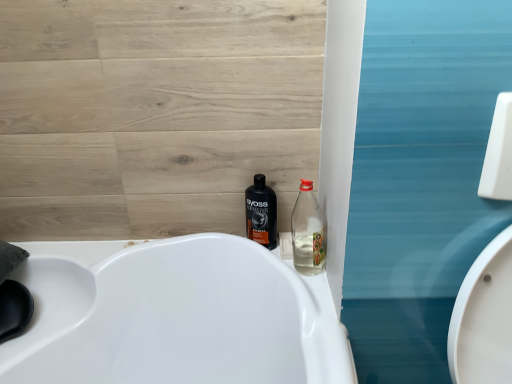
Question: Is shiny black bottle at center, which is the first bottle from left to right, outside clear plastic bottle at center-right, the second bottle when ordered from back to front?

Choices:
 (A) yes
 (B) no

Answer: (A)

Question: Is shiny black bottle at center, the second bottle positioned from the front, oriented towards clear plastic bottle at center-right, the 2th bottle in the left-to-right sequence?

Choices:
 (A) no
 (B) yes

Answer: (A)

Question: Can you confirm if shiny black bottle at center, the first bottle in the back-to-front sequence, is smaller than clear plastic bottle at center-right, placed as the 1th bottle when sorted from front to back?

Choices:
 (A) yes
 (B) no

Answer: (A)

Question: From a real-world perspective, is shiny black bottle at center, the second bottle positioned from the front, located beneath clear plastic bottle at center-right, placed as the 1th bottle when sorted from front to back?

Choices:
 (A) yes
 (B) no

Answer: (A)

Question: Can clear plastic bottle at center-right, the second bottle when ordered from back to front, be found inside shiny black bottle at center, the second bottle positioned from the front?

Choices:
 (A) yes
 (B) no

Answer: (B)

Question: Does shiny black bottle at center, the second bottle positioned from the front, lie behind clear plastic bottle at center-right, arranged as the first bottle when viewed from the right?

Choices:
 (A) yes
 (B) no

Answer: (A)

Question: Considering the relative positions of clear plastic bottle at center-right, placed as the 1th bottle when sorted from front to back, and shiny black bottle at center, the first bottle in the back-to-front sequence, in the image provided, is clear plastic bottle at center-right, placed as the 1th bottle when sorted from front to back, to the left of shiny black bottle at center, the first bottle in the back-to-front sequence, from the viewer's perspective?

Choices:
 (A) no
 (B) yes

Answer: (A)

Question: Is clear plastic bottle at center-right, the 2th bottle in the left-to-right sequence, not inside shiny black bottle at center, which is the first bottle from left to right?

Choices:
 (A) yes
 (B) no

Answer: (A)

Question: Does clear plastic bottle at center-right, the second bottle when ordered from back to front, have a lesser height compared to shiny black bottle at center, which is the first bottle from left to right?

Choices:
 (A) yes
 (B) no

Answer: (A)

Question: Can you confirm if clear plastic bottle at center-right, the second bottle when ordered from back to front, is smaller than shiny black bottle at center, which is the first bottle from left to right?

Choices:
 (A) yes
 (B) no

Answer: (B)

Question: Is clear plastic bottle at center-right, the second bottle when ordered from back to front, closer to the viewer compared to shiny black bottle at center, the second bottle positioned from the front?

Choices:
 (A) yes
 (B) no

Answer: (A)

Question: Considering the relative sizes of clear plastic bottle at center-right, the second bottle when ordered from back to front, and shiny black bottle at center, which is the first bottle from left to right, in the image provided, is clear plastic bottle at center-right, the second bottle when ordered from back to front, bigger than shiny black bottle at center, which is the first bottle from left to right,?

Choices:
 (A) no
 (B) yes

Answer: (B)

Question: Considering the relative positions of clear plastic bottle at center-right, placed as the 1th bottle when sorted from front to back, and shiny black bottle at center, the second bottle positioned from the front, in the image provided, is clear plastic bottle at center-right, placed as the 1th bottle when sorted from front to back, to the left or to the right of shiny black bottle at center, the second bottle positioned from the front,?

Choices:
 (A) right
 (B) left

Answer: (A)